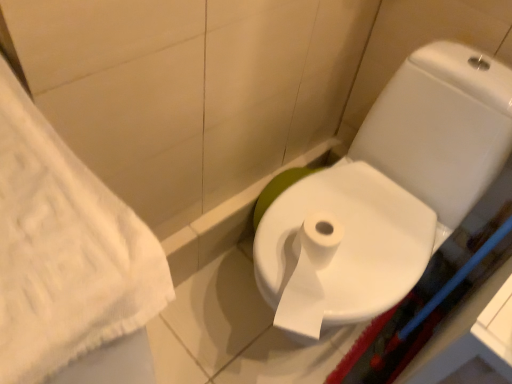
Question: Is white textured towel at left beside white glossy toilet at center?

Choices:
 (A) no
 (B) yes

Answer: (A)

Question: Is white textured towel at left behind white glossy toilet at center?

Choices:
 (A) no
 (B) yes

Answer: (A)

Question: Is white textured towel at left not close to white glossy toilet at center?

Choices:
 (A) yes
 (B) no

Answer: (B)

Question: Is white glossy toilet at center completely or partially inside white textured towel at left?

Choices:
 (A) no
 (B) yes

Answer: (A)

Question: Is white textured towel at left bigger than white glossy toilet at center?

Choices:
 (A) yes
 (B) no

Answer: (B)

Question: From the image's perspective, would you say white textured towel at left is shown under white glossy toilet at center?

Choices:
 (A) yes
 (B) no

Answer: (A)

Question: From the image's perspective, is white paper bidet at center on white textured towel at left?

Choices:
 (A) no
 (B) yes

Answer: (B)

Question: Is white paper bidet at center thinner than white textured towel at left?

Choices:
 (A) no
 (B) yes

Answer: (B)

Question: Is white paper bidet at center positioned with its back to white textured towel at left?

Choices:
 (A) yes
 (B) no

Answer: (B)

Question: Is white paper bidet at center taller than white textured towel at left?

Choices:
 (A) yes
 (B) no

Answer: (B)

Question: Considering the relative sizes of white paper bidet at center and white textured towel at left in the image provided, is white paper bidet at center smaller than white textured towel at left?

Choices:
 (A) yes
 (B) no

Answer: (A)

Question: From the image's perspective, does white paper bidet at center appear lower than white textured towel at left?

Choices:
 (A) yes
 (B) no

Answer: (B)

Question: Are white paper bidet at center and white glossy toilet at center beside each other?

Choices:
 (A) yes
 (B) no

Answer: (A)